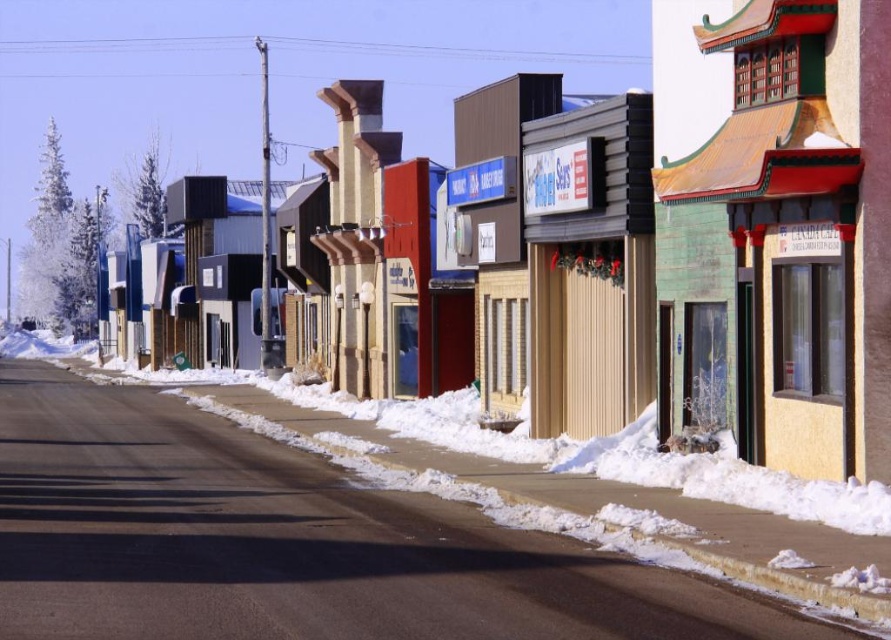
Is white powdery snow at center further to the viewer compared to green wooden building at center?

No, it is in front of green wooden building at center.

Does white powdery snow at center appear over green wooden building at center?

Incorrect, white powdery snow at center is not positioned above green wooden building at center.

Which is behind, point (100, 474) or point (820, 170)?

The point (100, 474) is behind.

The height and width of the screenshot is (640, 891). I want to click on white powdery snow at center, so click(x=288, y=541).